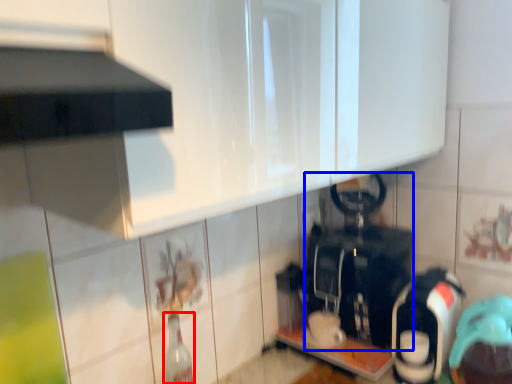
Question: Which of the following is the farthest to the observer, bottle (highlighted by a red box) or appliance (highlighted by a blue box)?

Choices:
 (A) bottle
 (B) appliance

Answer: (B)